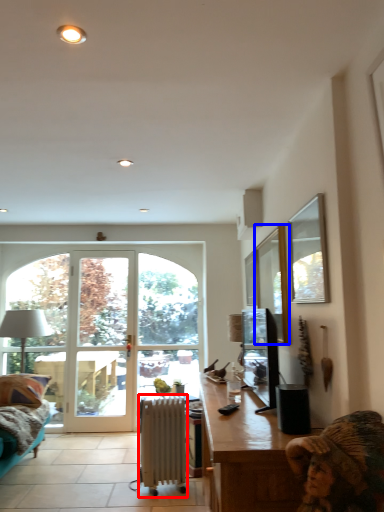
Question: Which object is closer to the camera taking this photo, radiator (highlighted by a red box) or window (highlighted by a blue box)?

Choices:
 (A) radiator
 (B) window

Answer: (B)